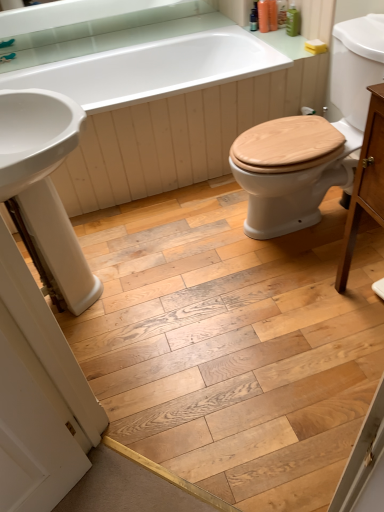
Question: In terms of height, does wooden at right look taller or shorter compared to light brown wood cabinet at right?

Choices:
 (A) tall
 (B) short

Answer: (B)

Question: From a real-world perspective, is wooden at right physically located above or below light brown wood cabinet at right?

Choices:
 (A) above
 (B) below

Answer: (B)

Question: Estimate the real-world distances between objects in this image. Which object is closer to the white glossy sink at left?

Choices:
 (A) light brown wood cabinet at right
 (B) brushed metal faucet at upper left
 (C) wooden at right
 (D) white glossy bathtub at upper center

Answer: (D)

Question: Which object is positioned farthest from the wooden at right?

Choices:
 (A) light brown wood cabinet at right
 (B) white glossy sink at left
 (C) white glossy bathtub at upper center
 (D) brushed metal faucet at upper left

Answer: (D)